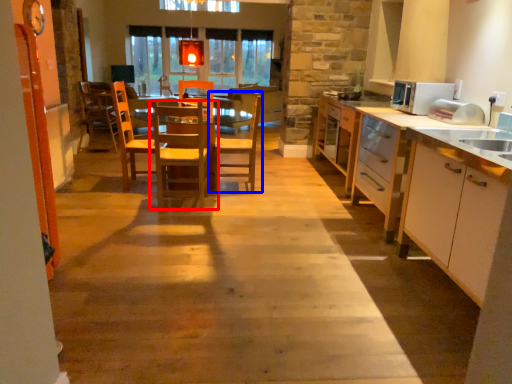
Question: Among these objects, which one is nearest to the camera, chair (highlighted by a red box) or chair (highlighted by a blue box)?

Choices:
 (A) chair
 (B) chair

Answer: (A)